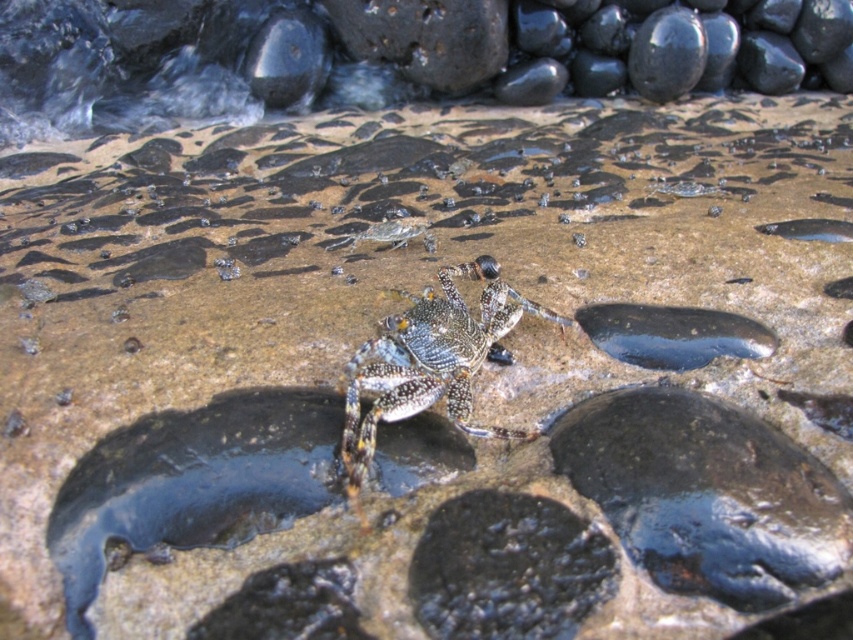
Does sparkling metallic crab at center have a greater width compared to glossy dark blue puddle at center right?

Yes, sparkling metallic crab at center is wider than glossy dark blue puddle at center right.

Is point (431, 368) closer to camera compared to point (700, 316)?

Yes, point (431, 368) is closer to viewer.

Image resolution: width=853 pixels, height=640 pixels. What are the coordinates of `sparkling metallic crab at center` in the screenshot? It's located at (428, 362).

At what (x,y) coordinates should I click in order to perform the action: click on sparkling metallic crab at center. Please return your answer as a coordinate pair (x, y). Looking at the image, I should click on (428, 362).

Describe the element at coordinates (672, 333) in the screenshot. This screenshot has height=640, width=853. I see `glossy dark blue puddle at center right` at that location.

I want to click on glossy dark blue puddle at center right, so click(x=672, y=333).

Who is higher up, sparkling metallic crab at center or shiny metallic crab at center?

shiny metallic crab at center is above.

Who is shorter, sparkling metallic crab at center or shiny metallic crab at center?

shiny metallic crab at center is shorter.

The height and width of the screenshot is (640, 853). Identify the location of sparkling metallic crab at center. click(x=428, y=362).